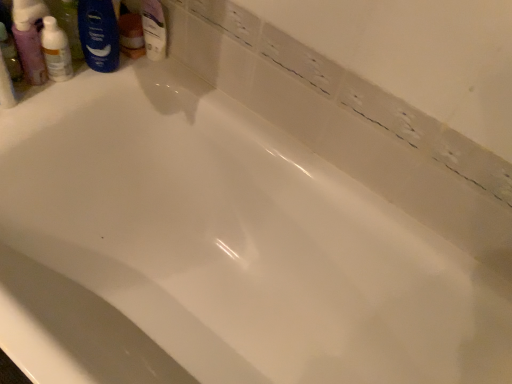
Question: Is translucent plastic bottle at upper left a part of translucent plastic mouthwash at upper left?

Choices:
 (A) yes
 (B) no

Answer: (B)

Question: Can you confirm if translucent plastic mouthwash at upper left is smaller than translucent plastic bottle at upper left?

Choices:
 (A) no
 (B) yes

Answer: (B)

Question: From the image's perspective, is translucent plastic mouthwash at upper left above translucent plastic bottle at upper left?

Choices:
 (A) no
 (B) yes

Answer: (A)

Question: Is translucent plastic mouthwash at upper left positioned before translucent plastic bottle at upper left?

Choices:
 (A) yes
 (B) no

Answer: (A)

Question: Considering the relative sizes of translucent plastic mouthwash at upper left and translucent plastic bottle at upper left in the image provided, is translucent plastic mouthwash at upper left taller than translucent plastic bottle at upper left?

Choices:
 (A) yes
 (B) no

Answer: (A)

Question: Considering the positions of translucent plastic bottle at upper left and translucent plastic mouthwash at upper left in the image, is translucent plastic bottle at upper left wider or thinner than translucent plastic mouthwash at upper left?

Choices:
 (A) thin
 (B) wide

Answer: (B)

Question: Is point (47, 26) positioned closer to the camera than point (26, 24)?

Choices:
 (A) closer
 (B) farther

Answer: (B)

Question: From a real-world perspective, is translucent plastic bottle at upper left positioned above or below translucent plastic mouthwash at upper left?

Choices:
 (A) above
 (B) below

Answer: (A)

Question: From their relative heights in the image, would you say translucent plastic bottle at upper left is taller or shorter than translucent plastic mouthwash at upper left?

Choices:
 (A) tall
 (B) short

Answer: (B)

Question: Considering the relative positions of blue matte shaving cream at upper left and translucent plastic bottle at upper left in the image provided, is blue matte shaving cream at upper left to the left or to the right of translucent plastic bottle at upper left?

Choices:
 (A) left
 (B) right

Answer: (B)

Question: Based on their sizes in the image, would you say blue matte shaving cream at upper left is bigger or smaller than translucent plastic bottle at upper left?

Choices:
 (A) big
 (B) small

Answer: (A)

Question: From the image's perspective, relative to translucent plastic bottle at upper left, is blue matte shaving cream at upper left above or below?

Choices:
 (A) below
 (B) above

Answer: (B)

Question: Is point (113, 36) positioned closer to the camera than point (52, 28)?

Choices:
 (A) closer
 (B) farther

Answer: (B)

Question: Relative to blue matte shaving cream at upper left, is translucent plastic mouthwash at upper left in front or behind?

Choices:
 (A) front
 (B) behind

Answer: (A)

Question: Looking at the image, does translucent plastic mouthwash at upper left seem bigger or smaller compared to blue matte shaving cream at upper left?

Choices:
 (A) big
 (B) small

Answer: (B)